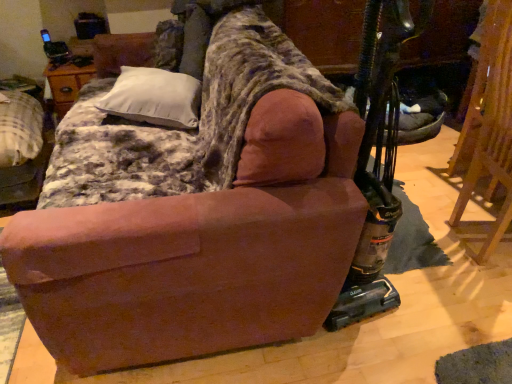
Question: Is the position of velvet-like brown armchair at center-left more distant than that of white soft pillow at upper left?

Choices:
 (A) yes
 (B) no

Answer: (A)

Question: Can you confirm if velvet-like brown armchair at center-left is smaller than white soft pillow at upper left?

Choices:
 (A) yes
 (B) no

Answer: (B)

Question: Is velvet-like brown armchair at center-left placed right next to white soft pillow at upper left?

Choices:
 (A) yes
 (B) no

Answer: (B)

Question: Is there a large distance between velvet-like brown armchair at center-left and white soft pillow at upper left?

Choices:
 (A) no
 (B) yes

Answer: (A)

Question: Is velvet-like brown armchair at center-left to the left of white soft pillow at upper left from the viewer's perspective?

Choices:
 (A) no
 (B) yes

Answer: (B)

Question: Does point (509, 140) appear closer or farther from the camera than point (227, 334)?

Choices:
 (A) farther
 (B) closer

Answer: (A)

Question: Considering the positions of wooden folding chair at right and brown suede couch at center in the image, is wooden folding chair at right bigger or smaller than brown suede couch at center?

Choices:
 (A) big
 (B) small

Answer: (B)

Question: Considering the positions of wooden folding chair at right and brown suede couch at center in the image, is wooden folding chair at right taller or shorter than brown suede couch at center?

Choices:
 (A) tall
 (B) short

Answer: (A)

Question: Would you say wooden folding chair at right is to the left or to the right of brown suede couch at center in the picture?

Choices:
 (A) right
 (B) left

Answer: (A)

Question: In terms of size, does brown suede couch at center appear bigger or smaller than white soft pillow at upper left?

Choices:
 (A) big
 (B) small

Answer: (A)

Question: Considering the positions of brown suede couch at center and white soft pillow at upper left in the image, is brown suede couch at center taller or shorter than white soft pillow at upper left?

Choices:
 (A) short
 (B) tall

Answer: (B)

Question: From a real-world perspective, is brown suede couch at center above or below white soft pillow at upper left?

Choices:
 (A) above
 (B) below

Answer: (B)

Question: Is brown suede couch at center inside the boundaries of white soft pillow at upper left, or outside?

Choices:
 (A) inside
 (B) outside

Answer: (B)

Question: Which is correct: velvet-like brown armchair at center-left is inside brown suede couch at center, or outside of it?

Choices:
 (A) inside
 (B) outside

Answer: (B)

Question: Looking at their shapes, would you say velvet-like brown armchair at center-left is wider or thinner than brown suede couch at center?

Choices:
 (A) wide
 (B) thin

Answer: (B)